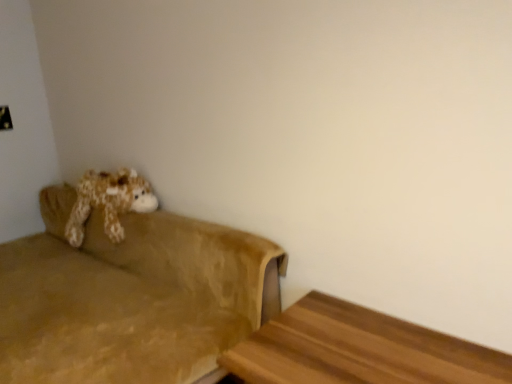
This screenshot has width=512, height=384. What do you see at coordinates (109, 202) in the screenshot? I see `fluffy brown plush at left` at bounding box center [109, 202].

Describe the element at coordinates (358, 350) in the screenshot. I see `wooden table at lower right` at that location.

This screenshot has height=384, width=512. I want to click on fluffy brown plush at left, so click(x=109, y=202).

How different are the orientations of wooden table at lower right and suede-like brown couch at left in degrees?

The angular difference between wooden table at lower right and suede-like brown couch at left is 1.01 degrees.

Is wooden table at lower right bigger than suede-like brown couch at left?

No.

Is wooden table at lower right inside the boundaries of suede-like brown couch at left, or outside?

wooden table at lower right is not inside suede-like brown couch at left, it's outside.

From a real-world perspective, does wooden table at lower right sit lower than suede-like brown couch at left?

Yes, from a real-world perspective, wooden table at lower right is under suede-like brown couch at left.

Considering the relative sizes of fluffy brown plush at left and suede-like brown couch at left in the image provided, is fluffy brown plush at left wider than suede-like brown couch at left?

Incorrect, the width of fluffy brown plush at left does not surpass that of suede-like brown couch at left.

From the image's perspective, is fluffy brown plush at left positioned above or below suede-like brown couch at left?

Clearly, from the image's perspective, fluffy brown plush at left is above suede-like brown couch at left.

Looking at this image, is suede-like brown couch at left at the back of fluffy brown plush at left?

That's right, fluffy brown plush at left is facing away from suede-like brown couch at left.

Is point (130, 191) positioned before point (156, 350)?

No, it is not.

Does suede-like brown couch at left have a greater width compared to fluffy brown plush at left?

Correct, the width of suede-like brown couch at left exceeds that of fluffy brown plush at left.

Could you tell me if suede-like brown couch at left is facing fluffy brown plush at left?

No, suede-like brown couch at left does not turn towards fluffy brown plush at left.

Which object is positioned more to the right, suede-like brown couch at left or fluffy brown plush at left?

From the viewer's perspective, fluffy brown plush at left appears more on the right side.

Which object is further away from the camera taking this photo, suede-like brown couch at left or fluffy brown plush at left?

fluffy brown plush at left is behind.

Considering the positions of objects wooden table at lower right and fluffy brown plush at left in the image provided, who is more to the left, wooden table at lower right or fluffy brown plush at left?

fluffy brown plush at left.

Which of these two, wooden table at lower right or fluffy brown plush at left, is smaller?

Smaller between the two is fluffy brown plush at left.

How different are the orientations of wooden table at lower right and fluffy brown plush at left in degrees?

They differ by 0.0194 degrees in their facing directions.

Is fluffy brown plush at left smaller than wooden table at lower right?

Yes, fluffy brown plush at left is smaller than wooden table at lower right.

Does fluffy brown plush at left have a lesser height compared to wooden table at lower right?

No, fluffy brown plush at left is not shorter than wooden table at lower right.

Is fluffy brown plush at left inside the boundaries of wooden table at lower right, or outside?

fluffy brown plush at left is not enclosed by wooden table at lower right.

Which object is further away from the camera taking this photo, fluffy brown plush at left or wooden table at lower right?

fluffy brown plush at left is behind.

Who is shorter, suede-like brown couch at left or wooden table at lower right?

wooden table at lower right is shorter.

Which is in front, point (54, 317) or point (386, 342)?

Positioned in front is point (386, 342).

From the image's perspective, which object appears higher, suede-like brown couch at left or wooden table at lower right?

suede-like brown couch at left is shown above in the image.

Identify the location of studio couch located behind the wooden table at lower right. Image resolution: width=512 pixels, height=384 pixels. (128, 297).

In order to click on studio couch in front of the fluffy brown plush at left in this screenshot , I will do `click(128, 297)`.

Considering their positions, is suede-like brown couch at left positioned further to fluffy brown plush at left than wooden table at lower right?

Based on the image, wooden table at lower right appears to be further to fluffy brown plush at left.

From the image, which object appears to be nearer to suede-like brown couch at left, wooden table at lower right or fluffy brown plush at left?

Among the two, fluffy brown plush at left is located nearer to suede-like brown couch at left.

When comparing their distances from wooden table at lower right, does suede-like brown couch at left or fluffy brown plush at left seem further?

fluffy brown plush at left lies further to wooden table at lower right than the other object.

Looking at the image, which one is located further to fluffy brown plush at left, wooden table at lower right or suede-like brown couch at left?

wooden table at lower right lies further to fluffy brown plush at left than the other object.

From the image, which object appears to be nearer to wooden table at lower right, fluffy brown plush at left or suede-like brown couch at left?

suede-like brown couch at left.

When comparing their distances from suede-like brown couch at left, does fluffy brown plush at left or wooden table at lower right seem further?

wooden table at lower right.

You are a GUI agent. You are given a task and a screenshot of the screen. Output one action in this format:
    pyautogui.click(x=<x>, y=<y>)
    Task: Click on the toy between suede-like brown couch at left and wooden table at lower right in the horizontal direction
    The width and height of the screenshot is (512, 384).
    Given the screenshot: What is the action you would take?
    (109, 202)